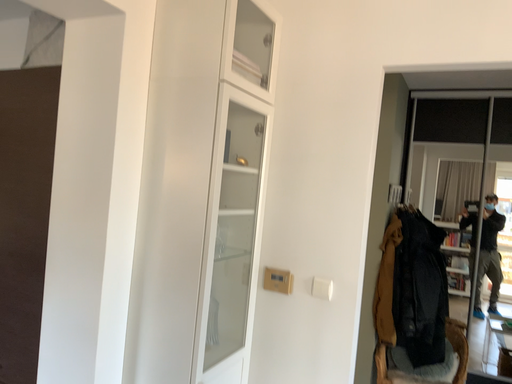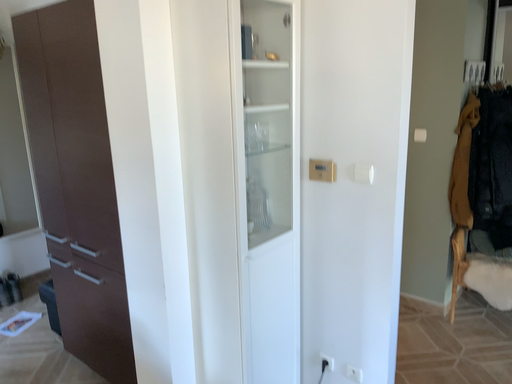
Question: How did the camera likely rotate when shooting the video?

Choices:
 (A) rotated upward
 (B) rotated downward

Answer: (B)